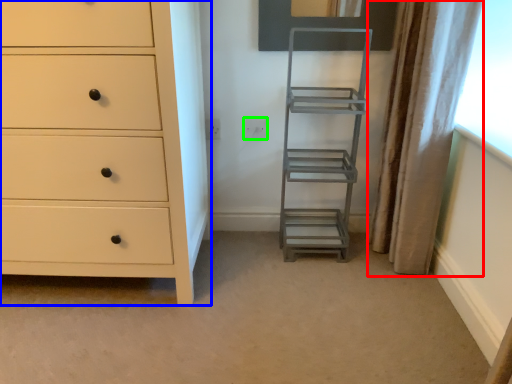
Question: Based on their relative distances, which object is nearer to curtain (highlighted by a red box)? Choose from chest of drawers (highlighted by a blue box) and electric outlet (highlighted by a green box).

Choices:
 (A) chest of drawers
 (B) electric outlet

Answer: (B)